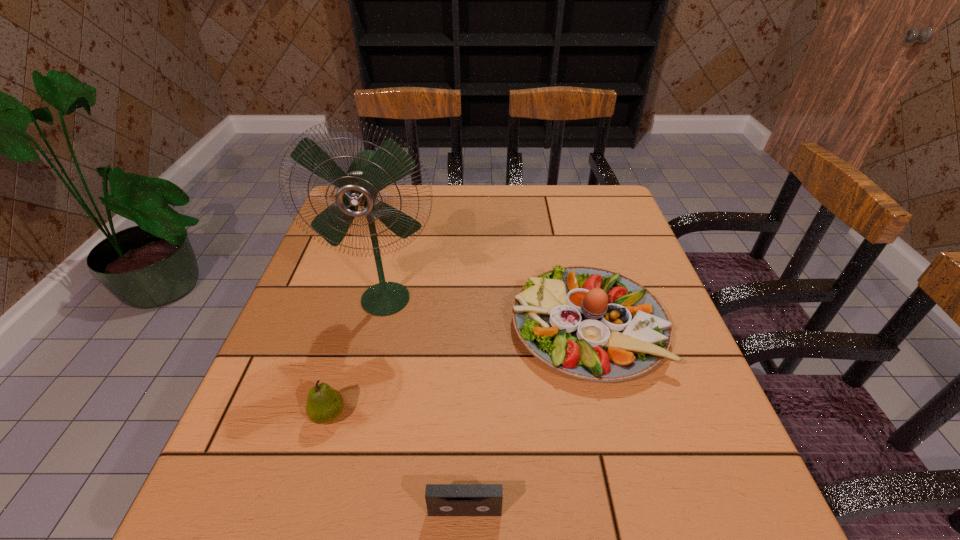
In the image, there is a desktop. Identify the location of vacant area at the near right corner. Image resolution: width=960 pixels, height=540 pixels. [x=748, y=523].

Identify the location of empty location between the rightmost object and the tallest object. (487, 312).

This screenshot has width=960, height=540. I want to click on unoccupied position between the fan and the salad plate, so click(487, 312).

Identify the location of unoccupied position between the pear and the second tallest object. (458, 370).

You are a GUI agent. You are given a task and a screenshot of the screen. Output one action in this format:
    pyautogui.click(x=<x>, y=<y>)
    Task: Click on the vacant area that lies between the nearest object and the fan
    Image resolution: width=960 pixels, height=540 pixels.
    Given the screenshot: What is the action you would take?
    pyautogui.click(x=425, y=404)

You are a GUI agent. You are given a task and a screenshot of the screen. Output one action in this format:
    pyautogui.click(x=<x>, y=<y>)
    Task: Click on the free space between the third shortest object and the fan
    
    Given the screenshot: What is the action you would take?
    pyautogui.click(x=487, y=312)

I want to click on free space that is in between the salad plate and the second object from right to left, so click(526, 418).

The height and width of the screenshot is (540, 960). I want to click on empty space that is in between the tallest object and the second shortest object, so click(357, 356).

Find the location of a particular element. The image size is (960, 540). vacant area between the fan and the third tallest object is located at coordinates (357, 356).

Identify the location of free space between the shortest object and the tallest object. (425, 404).